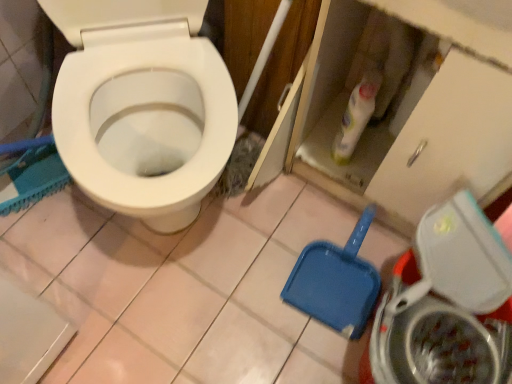
Locate an element on the screen. The width and height of the screenshot is (512, 384). white glossy bottle at upper center is located at coordinates (357, 115).

In the image, there is a blue plastic shovel at lower right. Identify the location of washing machine below it (from the image's perspective). (448, 304).

From a real-world perspective, who is located higher, blue plastic shovel at lower right or metallic silver washing machine at lower right?

In real-world perspective, metallic silver washing machine at lower right is above.

Considering the positions of points (331, 314) and (429, 233), is point (331, 314) farther from camera compared to point (429, 233)?

Yes, it is behind point (429, 233).

In the image, is blue plastic shovel at lower right on the left side or the right side of metallic silver washing machine at lower right?

From the image, it's evident that blue plastic shovel at lower right is to the left of metallic silver washing machine at lower right.

Is point (391, 326) positioned behind point (294, 270)?

No, (391, 326) is closer to viewer.

From the image's perspective, relative to blue plastic shovel at lower right, is metallic silver washing machine at lower right above or below?

Clearly, from the image's perspective, metallic silver washing machine at lower right is below blue plastic shovel at lower right.

Is there a large distance between metallic silver washing machine at lower right and blue plastic shovel at lower right?

metallic silver washing machine at lower right is actually quite close to blue plastic shovel at lower right.

Is metallic silver washing machine at lower right positioned in front of blue plastic shovel at lower right?

Yes.

Where is `washing machine in front of the white glossy bottle at upper center`? This screenshot has height=384, width=512. washing machine in front of the white glossy bottle at upper center is located at coordinates (448, 304).

Can you see metallic silver washing machine at lower right touching white glossy bottle at upper center?

metallic silver washing machine at lower right is not next to white glossy bottle at upper center, and they're not touching.

Looking at this image, which is less distant, (450, 222) or (335, 141)?

Positioned in front is point (450, 222).

Relative to white glossy bottle at upper center, is metallic silver washing machine at lower right in front or behind?

metallic silver washing machine at lower right is positioned closer to the viewer than white glossy bottle at upper center.

Locate an element on the screen. shovel that appears behind the white glossy bottle at upper center is located at coordinates (336, 282).

From the image's perspective, between white glossy bottle at upper center and blue plastic shovel at lower right, which one is located above?

white glossy bottle at upper center.

Is white glossy bottle at upper center smaller than blue plastic shovel at lower right?

Indeed, white glossy bottle at upper center has a smaller size compared to blue plastic shovel at lower right.

Between point (345, 144) and point (353, 252), which one is positioned behind?

The point (353, 252) is farther from the camera.

In terms of size, does white glossy bottle at upper center appear bigger or smaller than metallic silver washing machine at lower right?

In the image, white glossy bottle at upper center appears to be smaller than metallic silver washing machine at lower right.

Who is more distant, white glossy bottle at upper center or metallic silver washing machine at lower right?

white glossy bottle at upper center is behind.

From the image's perspective, is white glossy bottle at upper center located beneath metallic silver washing machine at lower right?

Actually, white glossy bottle at upper center appears above metallic silver washing machine at lower right in the image.

How much distance is there between blue plastic shovel at lower right and white glossy bottle at upper center?

blue plastic shovel at lower right is 31.11 centimeters away from white glossy bottle at upper center.

Is blue plastic shovel at lower right far away from white glossy bottle at upper center?

That's not correct — blue plastic shovel at lower right is a little close to white glossy bottle at upper center.

Which of these two, blue plastic shovel at lower right or white glossy bottle at upper center, is wider?

Wider between the two is blue plastic shovel at lower right.

Identify the location of shovel lying above the metallic silver washing machine at lower right (from the image's perspective). tap(336, 282).

Image resolution: width=512 pixels, height=384 pixels. I want to click on shovel on the left of metallic silver washing machine at lower right, so click(336, 282).

Considering their positions, is white glossy bottle at upper center positioned further to blue plastic shovel at lower right than metallic silver washing machine at lower right?

white glossy bottle at upper center is positioned further to the anchor blue plastic shovel at lower right.

Which object lies further to the anchor point metallic silver washing machine at lower right, white glossy bottle at upper center or blue plastic shovel at lower right?

Among the two, white glossy bottle at upper center is located further to metallic silver washing machine at lower right.

From the image, which object appears to be farther from white glossy bottle at upper center, metallic silver washing machine at lower right or blue plastic shovel at lower right?

metallic silver washing machine at lower right.

When comparing their distances from blue plastic shovel at lower right, does metallic silver washing machine at lower right or white glossy bottle at upper center seem closer?

Among the two, metallic silver washing machine at lower right is located nearer to blue plastic shovel at lower right.

Which object lies nearer to the anchor point metallic silver washing machine at lower right, blue plastic shovel at lower right or white glossy bottle at upper center?

blue plastic shovel at lower right lies closer to metallic silver washing machine at lower right than the other object.

Estimate the real-world distances between objects in this image. Which object is closer to white glossy bottle at upper center, blue plastic shovel at lower right or metallic silver washing machine at lower right?

Among the two, blue plastic shovel at lower right is located nearer to white glossy bottle at upper center.

The height and width of the screenshot is (384, 512). Identify the location of shovel between white glossy bottle at upper center and metallic silver washing machine at lower right from top to bottom. (336, 282).